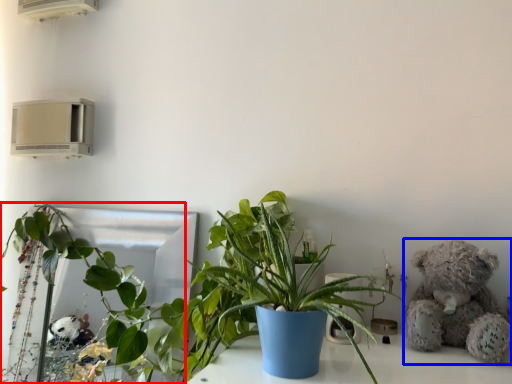
Question: Which object appears closest to the camera in this image, houseplant (highlighted by a red box) or teddy bear (highlighted by a blue box)?

Choices:
 (A) houseplant
 (B) teddy bear

Answer: (B)